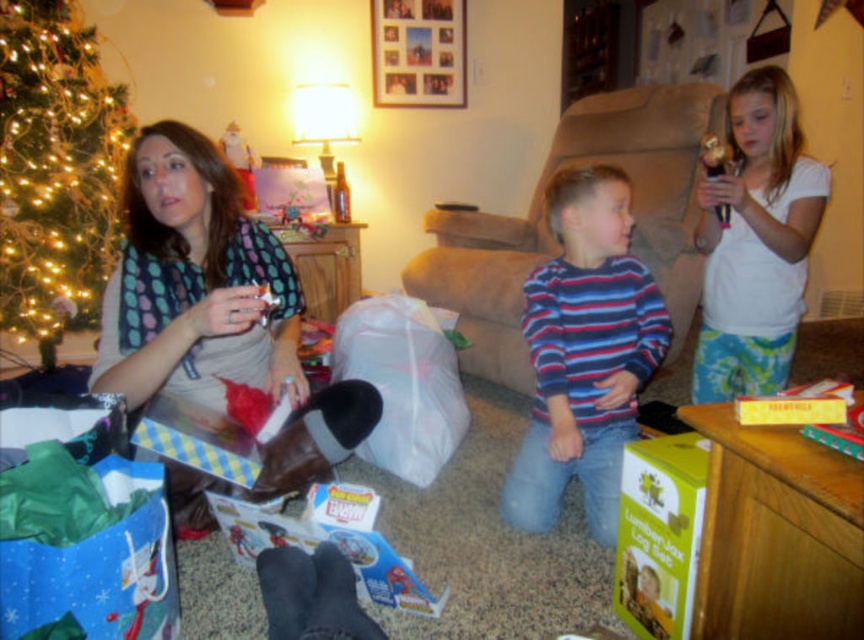
Does striped cotton shirt at center appear on the left side of green matte christmas tree at left?

Incorrect, striped cotton shirt at center is not on the left side of green matte christmas tree at left.

Does striped cotton shirt at center appear under green matte christmas tree at left?

Indeed, striped cotton shirt at center is positioned under green matte christmas tree at left.

Find the location of a particular element. This screenshot has width=864, height=640. striped cotton shirt at center is located at coordinates (583, 353).

Describe the element at coordinates (194, 282) in the screenshot. This screenshot has height=640, width=864. I see `polka dot fabric shirt at left` at that location.

Locate an element on the screen. The height and width of the screenshot is (640, 864). polka dot fabric shirt at left is located at coordinates (194, 282).

Is polka dot fabric shirt at left taller than green matte christmas tree at left?

Incorrect, polka dot fabric shirt at left's height is not larger of green matte christmas tree at left's.

Which is more to the left, polka dot fabric shirt at left or green matte christmas tree at left?

green matte christmas tree at left

Image resolution: width=864 pixels, height=640 pixels. I want to click on polka dot fabric shirt at left, so click(x=194, y=282).